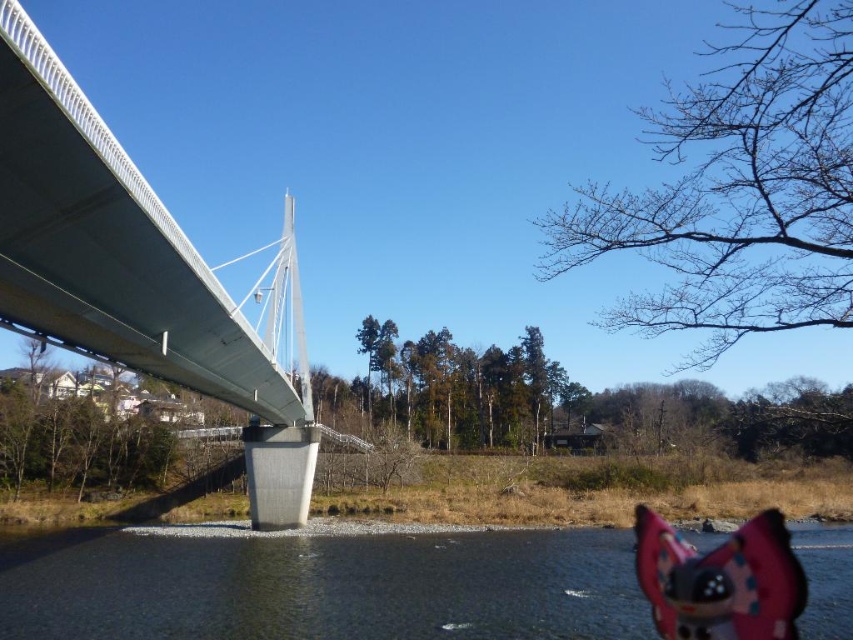
Question: Which point is closer to the camera?

Choices:
 (A) (503, 547)
 (B) (277, 262)

Answer: (A)

Question: Where is clear water at lower right located in relation to silver metallic suspension bridge at left in the image?

Choices:
 (A) right
 (B) left

Answer: (A)

Question: Is clear water at lower right wider than silver metallic suspension bridge at left?

Choices:
 (A) yes
 (B) no

Answer: (A)

Question: Among these points, which one is nearest to the camera?

Choices:
 (A) (163, 326)
 (B) (387, 576)

Answer: (A)

Question: Which of the following is the closest to the observer?

Choices:
 (A) silver metallic suspension bridge at left
 (B) clear water at lower right

Answer: (A)

Question: Does clear water at lower right come behind silver metallic suspension bridge at left?

Choices:
 (A) yes
 (B) no

Answer: (A)